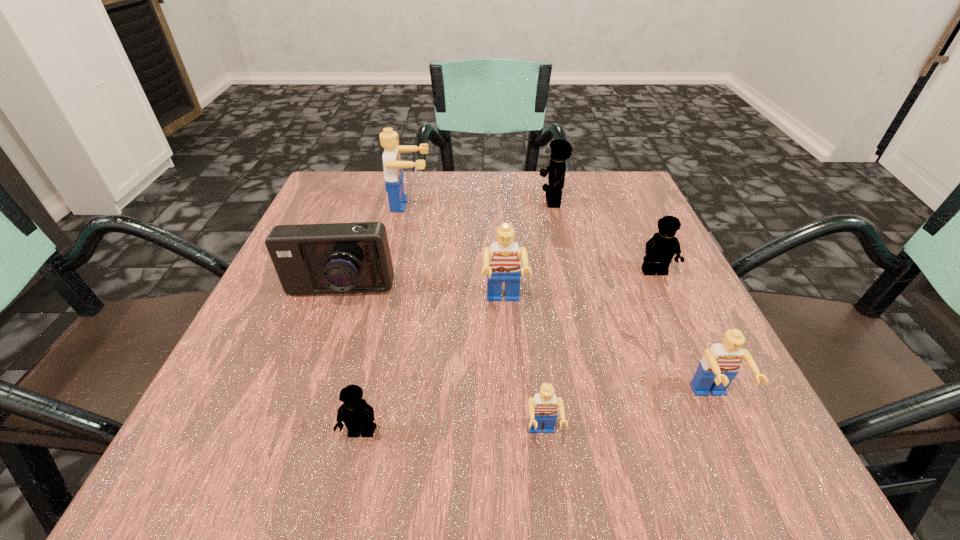
The width and height of the screenshot is (960, 540). What are the coordinates of `the rightmost blue Lego` in the screenshot? It's located at (716, 370).

Where is `the nearest yellow Lego`? The height and width of the screenshot is (540, 960). the nearest yellow Lego is located at coordinates (358, 416).

Image resolution: width=960 pixels, height=540 pixels. I want to click on the leftmost yellow Lego, so click(x=358, y=416).

Identify the location of the smallest blue Lego. coord(543,408).

Find the location of a particular element. free space located 0.080m on the face of the leftmost blue Lego is located at coordinates (466, 205).

Find the location of `free space located on the front-facing side of the third Lego from right to left`. free space located on the front-facing side of the third Lego from right to left is located at coordinates (452, 201).

Where is `free space located on the front-facing side of the third Lego from right to left`? free space located on the front-facing side of the third Lego from right to left is located at coordinates (516, 201).

What are the coordinates of `vacant space positioned on the front-facing side of the third Lego from right to left` in the screenshot? It's located at (384, 201).

Find the location of a particular element. Image resolution: width=960 pixels, height=540 pixels. vacant area situated on the face of the fourth farthest Lego is located at coordinates (510, 410).

Find the location of a particular element. The height and width of the screenshot is (540, 960). vacant space located on the front-facing side of the camera is located at coordinates (300, 406).